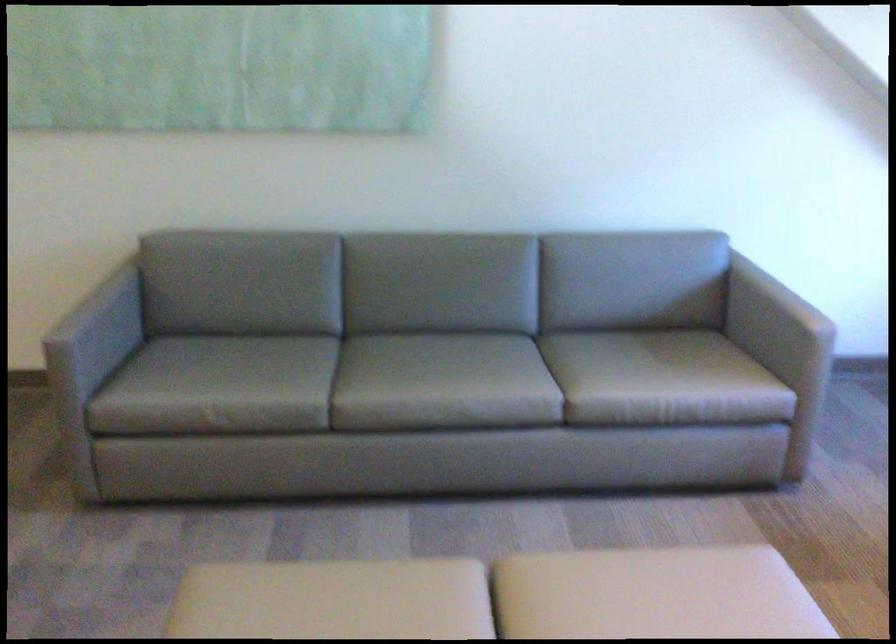
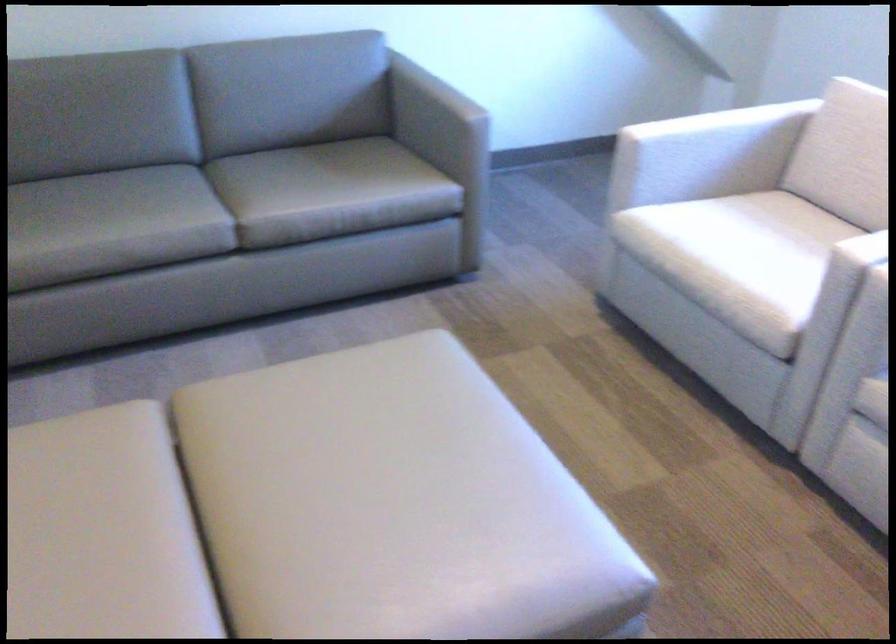
Question: Based on the continuous images, in which direction is the camera rotating? Reply with the corresponding letter.

Choices:
 (A) Left
 (B) Right
 (C) Up
 (D) Down

Answer: (B)